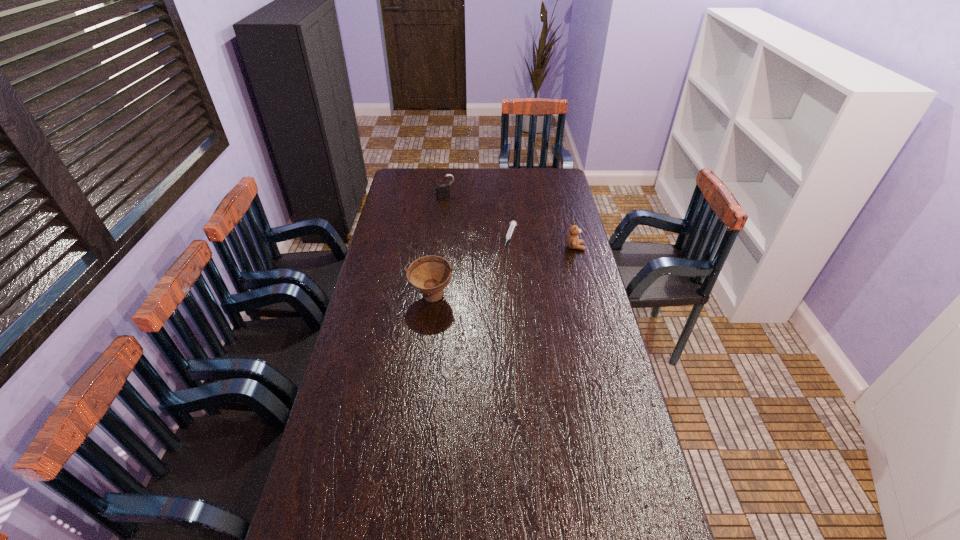
Point out which object is positioned as the second nearest to the farthest object. Please provide its 2D coordinates. Your answer should be formatted as a tuple, i.e. [(x, y)], where the tuple contains the x and y coordinates of a point satisfying the conditions above.

[(573, 242)]

Where is `free space that satisfies the following two spatial constraints: 1. on the front side of the padlock; 2. on the front-facing side of the rightmost object`? The height and width of the screenshot is (540, 960). free space that satisfies the following two spatial constraints: 1. on the front side of the padlock; 2. on the front-facing side of the rightmost object is located at coordinates (441, 247).

This screenshot has height=540, width=960. Find the location of `free location that satisfies the following two spatial constraints: 1. on the back side of the shortest object; 2. on the right side of the soup bowl`. free location that satisfies the following two spatial constraints: 1. on the back side of the shortest object; 2. on the right side of the soup bowl is located at coordinates (439, 237).

What are the coordinates of `vacant space that satisfies the following two spatial constraints: 1. on the front side of the second object from right to left; 2. on the right side of the padlock` in the screenshot? It's located at (442, 237).